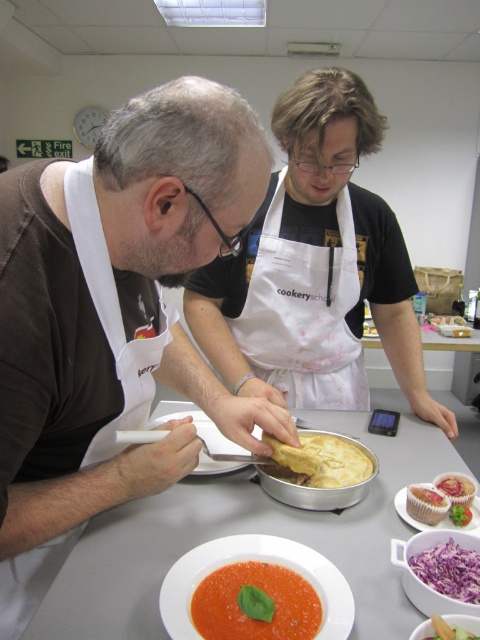
Question: Which object appears farthest from the camera in this image?

Choices:
 (A) golden flaky pie at center
 (B) white matte table at center

Answer: (A)

Question: Is white matte table at center positioned at the back of matte white cupcake at lower right?

Choices:
 (A) no
 (B) yes

Answer: (A)

Question: From the image, what is the correct spatial relationship of matte brown apron at left in relation to smooth white cake at center?

Choices:
 (A) below
 (B) above

Answer: (B)

Question: Which object appears farthest from the camera in this image?

Choices:
 (A) golden flaky pie at center
 (B) smooth white cake at center
 (C) tomato puree at center

Answer: (A)

Question: Which of these objects is positioned farthest from the tomato puree at center?

Choices:
 (A) matte paper cupcake at center
 (B) purple shredded cabbage at lower center
 (C) green leafy vegetable at center

Answer: (C)

Question: Is purple shredded cabbage at lower center smaller than smooth white cake at center?

Choices:
 (A) yes
 (B) no

Answer: (B)